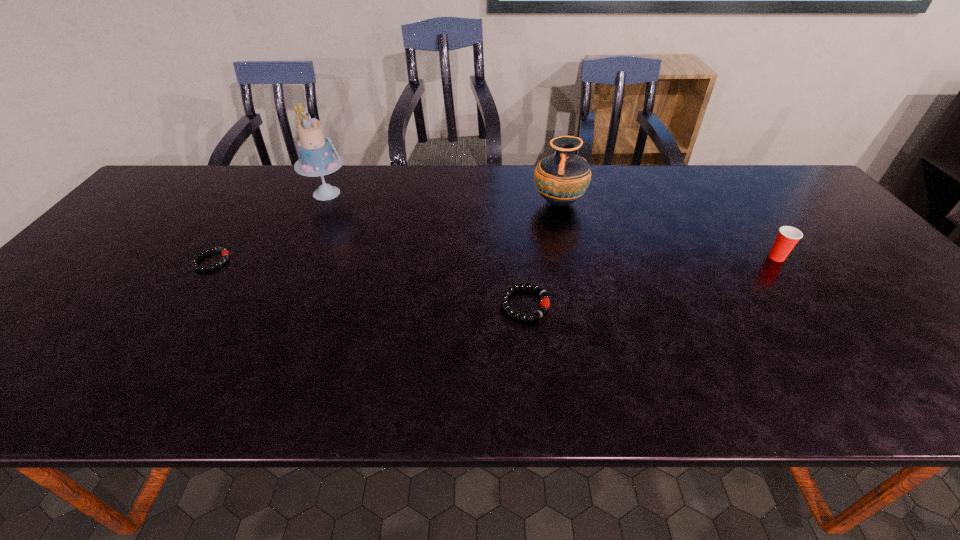
In the image, there is a desktop. Where is `free space at the far right corner`? free space at the far right corner is located at coordinates (781, 184).

Where is `vacant region between the fourth tallest object and the pottery`? The image size is (960, 540). vacant region between the fourth tallest object and the pottery is located at coordinates (541, 254).

What are the coordinates of `empty space that is in between the farther bracelet and the rightmost object` in the screenshot? It's located at (494, 259).

The height and width of the screenshot is (540, 960). I want to click on empty space that is in between the pottery and the rightmost object, so click(667, 230).

At what (x,y) coordinates should I click in order to perform the action: click on empty location between the cake and the pottery. Please return your answer as a coordinate pair (x, y). Looking at the image, I should click on (443, 198).

Image resolution: width=960 pixels, height=540 pixels. Find the location of `unoccupied position between the nearer bracelet and the tallest object`. unoccupied position between the nearer bracelet and the tallest object is located at coordinates pyautogui.click(x=426, y=249).

The height and width of the screenshot is (540, 960). What are the coordinates of `empty space between the taller bracelet and the third shortest object` in the screenshot? It's located at (651, 281).

Where is `vacant space that is in between the nearest object and the tallest object`? The width and height of the screenshot is (960, 540). vacant space that is in between the nearest object and the tallest object is located at coordinates (426, 249).

The image size is (960, 540). Find the location of `empty location between the pottery and the cake`. empty location between the pottery and the cake is located at coordinates pyautogui.click(x=443, y=198).

Identify the location of free space between the rightmost object and the fourth shortest object. (667, 230).